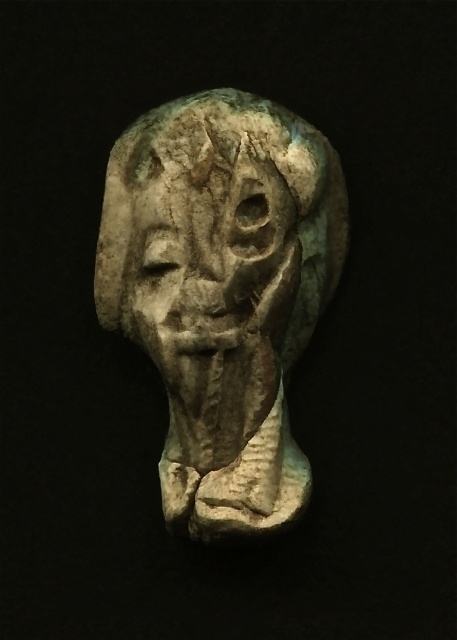
You are an archaeologist examining the sculpture. You notice two parts labeled as the gray stone head at center and the gray stone face at center. Which part is closer to you?

The gray stone head at center is closer to you because the gray stone face at center is behind it.

Based on the photo, you are an archaeologist examining a coordinate map of an excavation site. The map shows a gray stone head at center. Where is the gray stone head located in terms of coordinates?

The gray stone head at center is located at coordinates point [223,292].

You are an archaeologist examining the sculpture. You notice two parts labeled as the gray stone head at center and the gray stone face at center. Which part is taller?

The gray stone head at center is taller than the gray stone face at center according to the description.